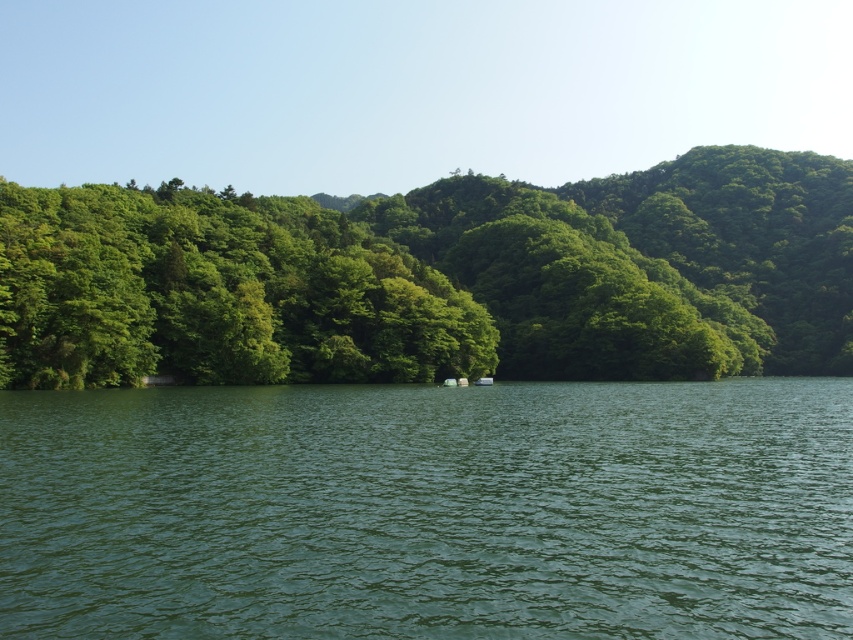
Question: Which of the following is the closest to the observer?

Choices:
 (A) green liquid water at center
 (B) green leafy trees at left

Answer: (A)

Question: Can you confirm if green liquid water at center is smaller than green leafy trees at left?

Choices:
 (A) yes
 (B) no

Answer: (A)

Question: Which of the following is the farthest from the observer?

Choices:
 (A) (563, 422)
 (B) (845, 372)

Answer: (B)

Question: Where is green liquid water at center located in relation to green leafy trees at left in the image?

Choices:
 (A) below
 (B) above

Answer: (A)

Question: Can you confirm if green liquid water at center is wider than green leafy trees at left?

Choices:
 (A) yes
 (B) no

Answer: (B)

Question: Which object appears farthest from the camera in this image?

Choices:
 (A) green liquid water at center
 (B) green leafy trees at left

Answer: (B)